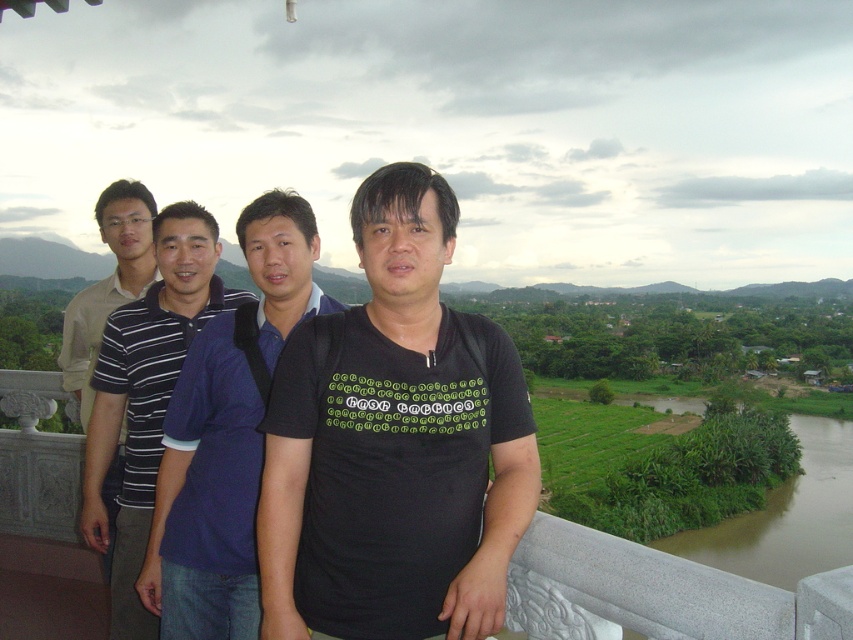
Who is lower down, brown muddy water at lower right or striped cotton polo shirt at left?

brown muddy water at lower right

Who is more forward, (811, 538) or (109, 529)?

Point (109, 529) is more forward.

Locate an element on the screen. brown muddy water at lower right is located at coordinates (787, 516).

This screenshot has height=640, width=853. Identify the location of black matte shirt at center. (395, 445).

Describe the element at coordinates (395, 445) in the screenshot. I see `black matte shirt at center` at that location.

Does point (514, 410) lie in front of point (67, 381)?

Yes, it is in front of point (67, 381).

Where is `black matte shirt at center`? black matte shirt at center is located at coordinates (395, 445).

How much distance is there between dark blue polo shirt at center and brown muddy water at lower right?

dark blue polo shirt at center is 72.95 meters away from brown muddy water at lower right.

This screenshot has height=640, width=853. Identify the location of dark blue polo shirt at center. 148,394.